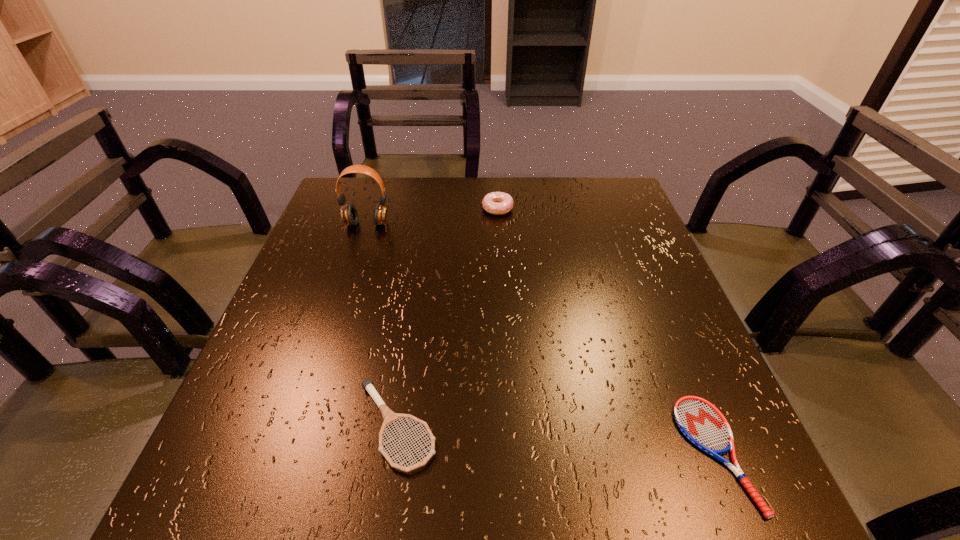
The height and width of the screenshot is (540, 960). I want to click on empty space between the shorter tennis racket and the taller tennis racket, so click(556, 440).

Identify the location of free space that is in between the third object from left to right and the shortest object. This screenshot has width=960, height=540. (606, 331).

At what (x,y) coordinates should I click in order to perform the action: click on vacant space that is in between the shortest object and the farthest object. Please return your answer as a coordinate pair (x, y). Image resolution: width=960 pixels, height=540 pixels. Looking at the image, I should click on (606, 331).

Find the location of `unoccupied area between the headset and the shortest object`. unoccupied area between the headset and the shortest object is located at coordinates (540, 339).

Identify the location of the closest object to the second farthest object. Image resolution: width=960 pixels, height=540 pixels. (498, 203).

I want to click on object that is the third closest one to the shortest object, so click(349, 215).

The height and width of the screenshot is (540, 960). I want to click on free space that satisfies the following two spatial constraints: 1. on the front side of the shortest object; 2. on the left side of the second object from left to right, so click(392, 453).